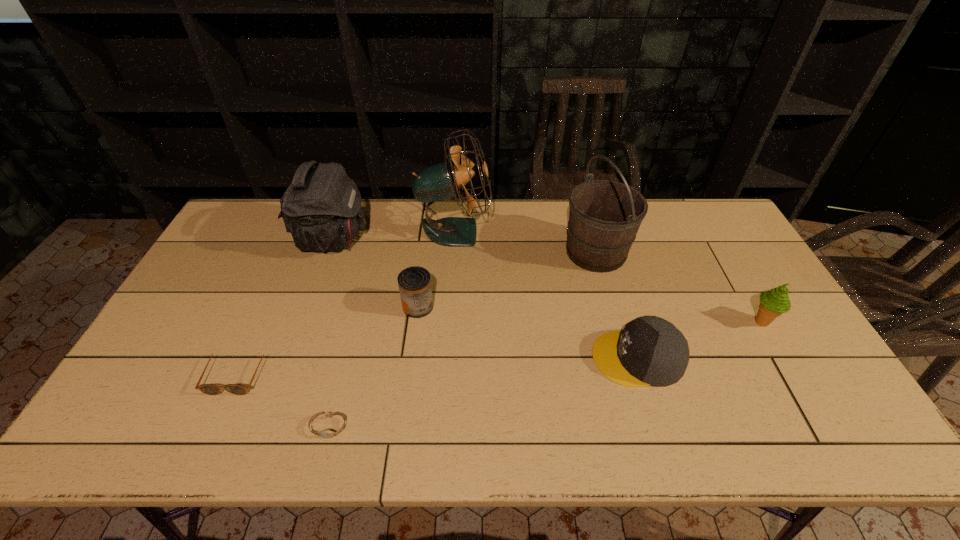
Find the location of a particular element. This screenshot has width=960, height=540. fan is located at coordinates (442, 181).

Locate an element on the screen. This screenshot has height=540, width=960. bucket is located at coordinates (604, 218).

Image resolution: width=960 pixels, height=540 pixels. Find the location of `shoulder bag`. shoulder bag is located at coordinates (321, 208).

Identify the location of the rightmost object. click(x=773, y=303).

Locate an element on the screen. The width and height of the screenshot is (960, 540). icecream is located at coordinates (773, 303).

This screenshot has width=960, height=540. I want to click on can, so click(x=415, y=288).

Where is `cap`? cap is located at coordinates (650, 351).

You are a GUI agent. You are given a task and a screenshot of the screen. Output one action in this format:
    pyautogui.click(x=<x>, y=<y>)
    Task: Click on the sunglasses
    
    Given the screenshot: What is the action you would take?
    pyautogui.click(x=209, y=389)

Find the location of `the shortest object`. the shortest object is located at coordinates (327, 434).

Locate an element on the screen. the nearest object is located at coordinates (327, 434).